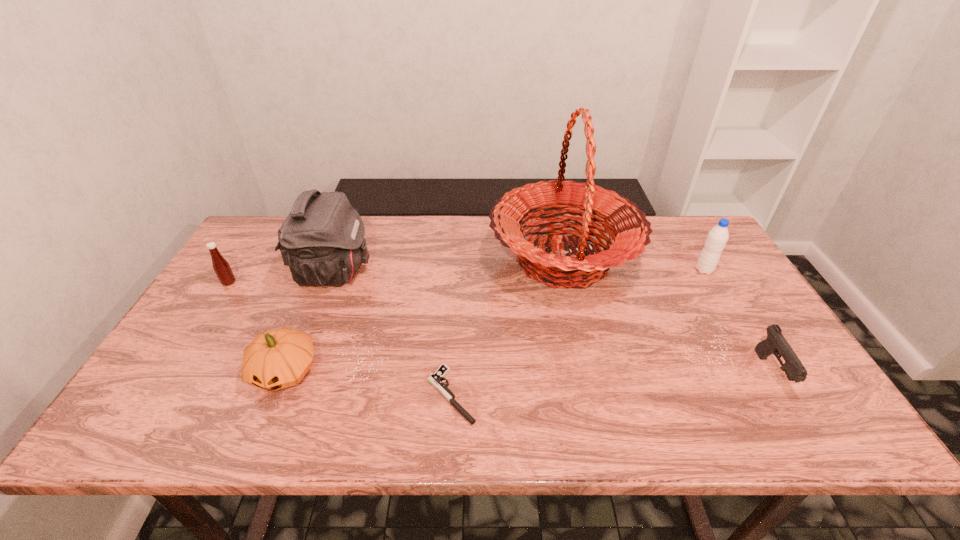
Locate an element on the screen. The image size is (960, 540). shoulder bag that is at the far edge is located at coordinates (322, 241).

The image size is (960, 540). What are the coordinates of `object at the near edge` in the screenshot? It's located at (435, 379).

The height and width of the screenshot is (540, 960). What are the coordinates of `object at the left edge` in the screenshot? It's located at (221, 267).

The width and height of the screenshot is (960, 540). I want to click on water bottle that is at the right edge, so click(717, 238).

At what (x,y) coordinates should I click in order to perform the action: click on pistol positioned at the right edge. Please return your answer as a coordinate pair (x, y). Looking at the image, I should click on (776, 344).

At what (x,y) coordinates should I click in order to perform the action: click on free space at the far edge. Please return your answer as a coordinate pair (x, y). This screenshot has width=960, height=540. Looking at the image, I should click on (438, 226).

The width and height of the screenshot is (960, 540). Identify the location of vacant region at the near edge. (536, 407).

In the image, there is a desktop. At what (x,y) coordinates should I click in order to perform the action: click on vacant space at the left edge. Please return your answer as a coordinate pair (x, y). Image resolution: width=960 pixels, height=540 pixels. Looking at the image, I should click on (206, 373).

What are the coordinates of `vacant space at the right edge of the desktop` in the screenshot? It's located at (762, 367).

Image resolution: width=960 pixels, height=540 pixels. What are the coordinates of `blank space at the far left corner of the desktop` in the screenshot? It's located at (267, 219).